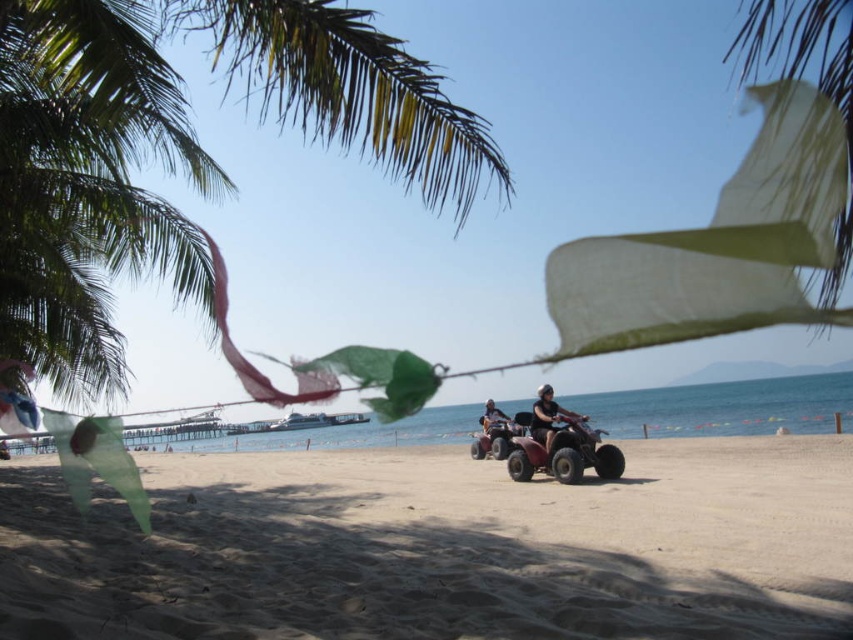
Is sandy beach at lower center to the right of green leafy palm tree at upper left from the viewer's perspective?

Yes, sandy beach at lower center is to the right of green leafy palm tree at upper left.

Is sandy beach at lower center above green leafy palm tree at upper left?

Incorrect, sandy beach at lower center is not positioned above green leafy palm tree at upper left.

The width and height of the screenshot is (853, 640). I want to click on sandy beach at lower center, so click(440, 547).

Is point (548, 401) less distant than point (482, 419)?

Yes, point (548, 401) is in front of point (482, 419).

At what (x,y) coordinates should I click in order to perform the action: click on metallic silver quad bike at center. Please return your answer as a coordinate pair (x, y). The height and width of the screenshot is (640, 853). Looking at the image, I should click on (548, 417).

Locate an element on the screen. The image size is (853, 640). metallic silver quad bike at center is located at coordinates (548, 417).

Is sandy beach at lower center taller than matte black quad bike at center?

Yes.

Locate an element on the screen. sandy beach at lower center is located at coordinates (440, 547).